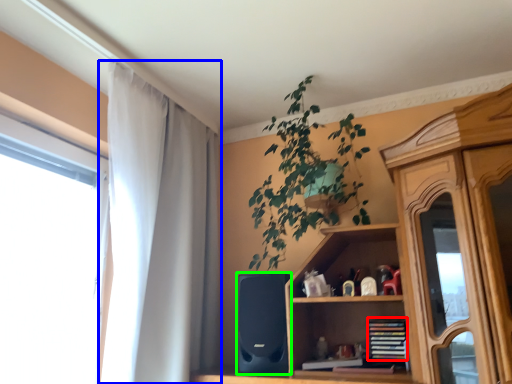
Question: Based on their relative distances, which object is farther from book (highlighted by a red box)? Choose from curtain (highlighted by a blue box) and speaker (highlighted by a green box).

Choices:
 (A) curtain
 (B) speaker

Answer: (A)